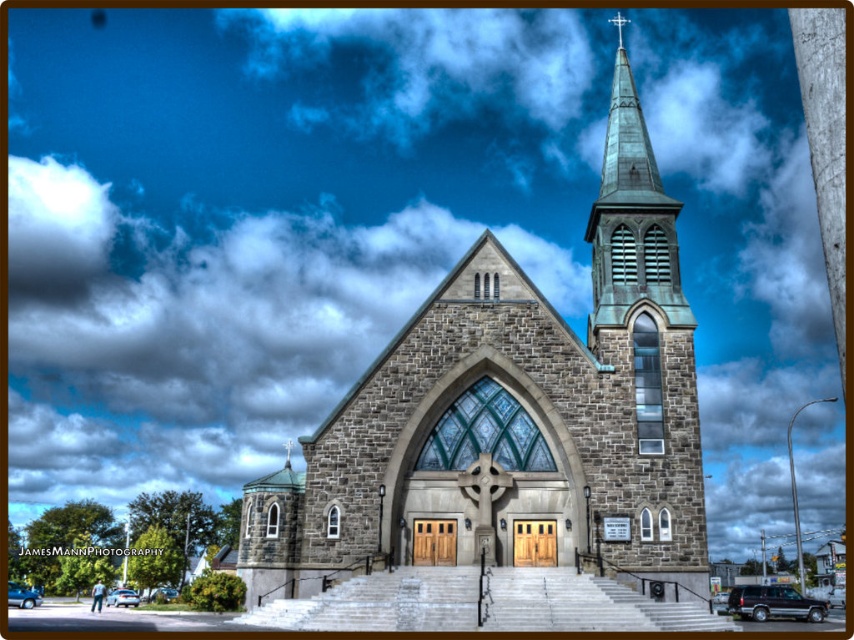
Question: Is green copper steeple at upper right wider than green copper spire at upper center?

Choices:
 (A) yes
 (B) no

Answer: (A)

Question: Does green copper steeple at upper right lie in front of green copper spire at upper center?

Choices:
 (A) no
 (B) yes

Answer: (B)

Question: Which point is closer to the camera taking this photo?

Choices:
 (A) 654,499
 (B) 594,433

Answer: (A)

Question: Which point is closer to the camera?

Choices:
 (A) (544, 412)
 (B) (621, 16)
 (C) (654, 563)

Answer: (C)

Question: Based on their relative distances, which object is nearer to the green copper spire at upper center?

Choices:
 (A) gray stone church at center
 (B) green copper steeple at upper right

Answer: (B)

Question: Does gray stone church at center appear under green copper spire at upper center?

Choices:
 (A) no
 (B) yes

Answer: (B)